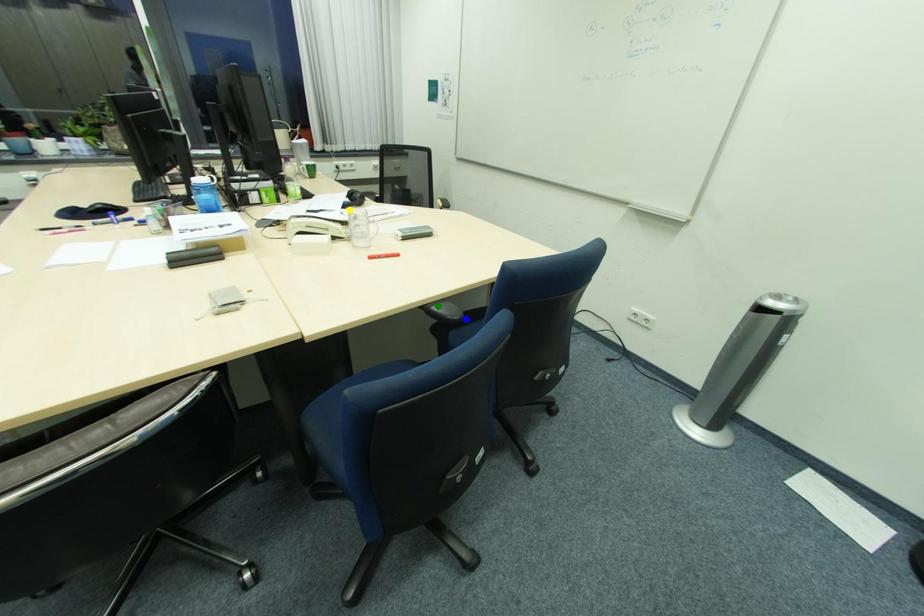
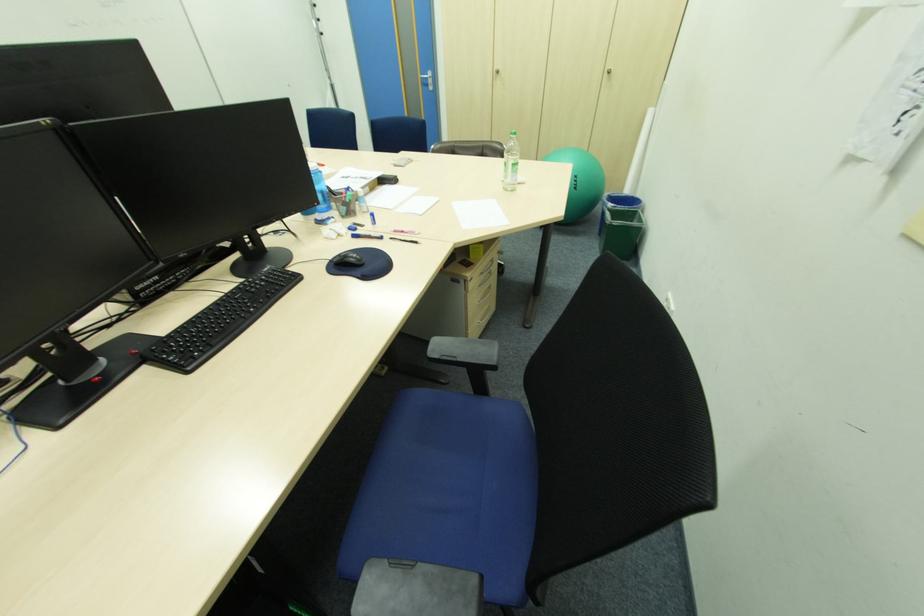
I am providing you with two images of the same scene from different viewpoints. Three points are marked in image1. Which point corresponds to a part or object that is occluded in image2?In image1, three points are marked. Which of them correspond to a part or object that is occluded in image2?Among the three points shown in image1, which one corresponds to a part or object that is no longer visible due to occlusion in image2?

blue point, yellow point, green point